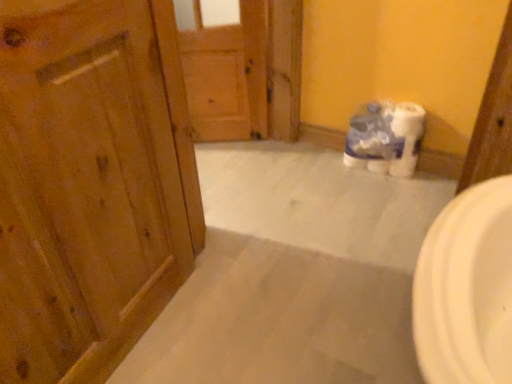
Locate an element on the screen. The width and height of the screenshot is (512, 384). free spot above white plastic toilet paper at center (from a real-world perspective) is located at coordinates (398, 103).